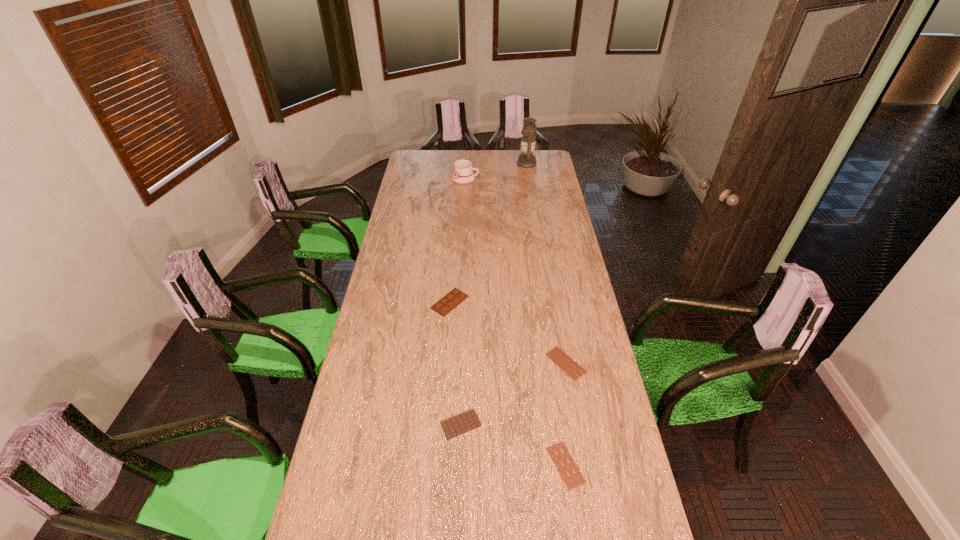
Find the location of a particular element. The image size is (960, 540). free space that satisfies the following two spatial constraints: 1. on the side with the handle of the second farthest chocolate bar; 2. on the left side of the fifth nearest object is located at coordinates (456, 363).